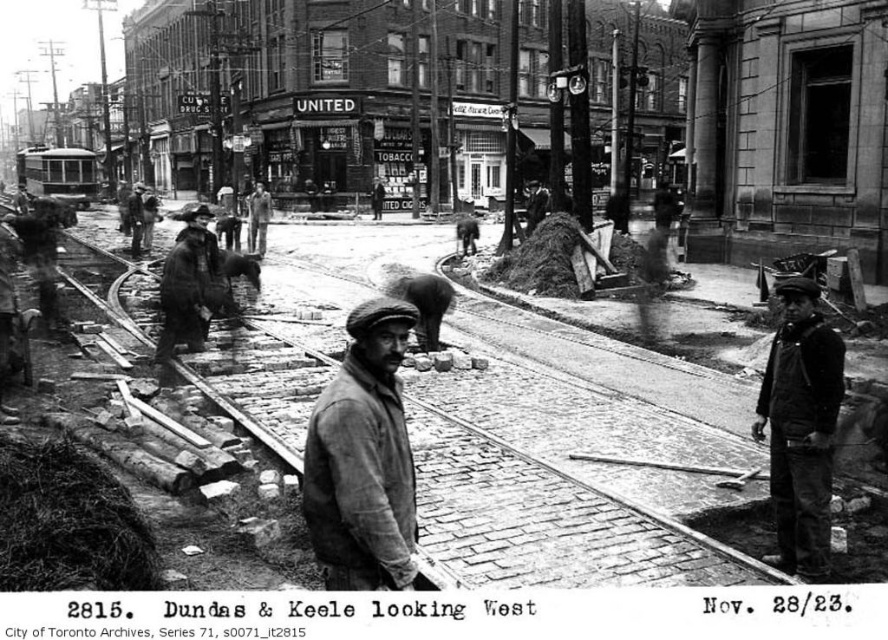
Question: Is smooth wooden planks at center behind coarse woolen coat at center-left?

Choices:
 (A) yes
 (B) no

Answer: (B)

Question: Which of the following is the closest to the observer?

Choices:
 (A) (266, 214)
 (B) (382, 435)
 (C) (806, 435)

Answer: (B)

Question: Can you confirm if smooth wooden planks at center is wider than worn brown jacket at center?

Choices:
 (A) no
 (B) yes

Answer: (B)

Question: Estimate the real-world distances between objects in this image. Which object is closer to the dark gray fabric jacket at center?

Choices:
 (A) worn brown jacket at center
 (B) coarse woolen coat at center-left
 (C) rugged brown coat at center
 (D) smooth wooden planks at center

Answer: (A)

Question: Which object is positioned farthest from the rugged brown coat at center?

Choices:
 (A) worn brown jacket at center
 (B) coarse woolen coat at center-left
 (C) smooth wooden planks at center
 (D) dark gray fabric jacket at center

Answer: (A)

Question: Does smooth wooden planks at center appear under dark gray fabric jacket at center?

Choices:
 (A) no
 (B) yes

Answer: (A)